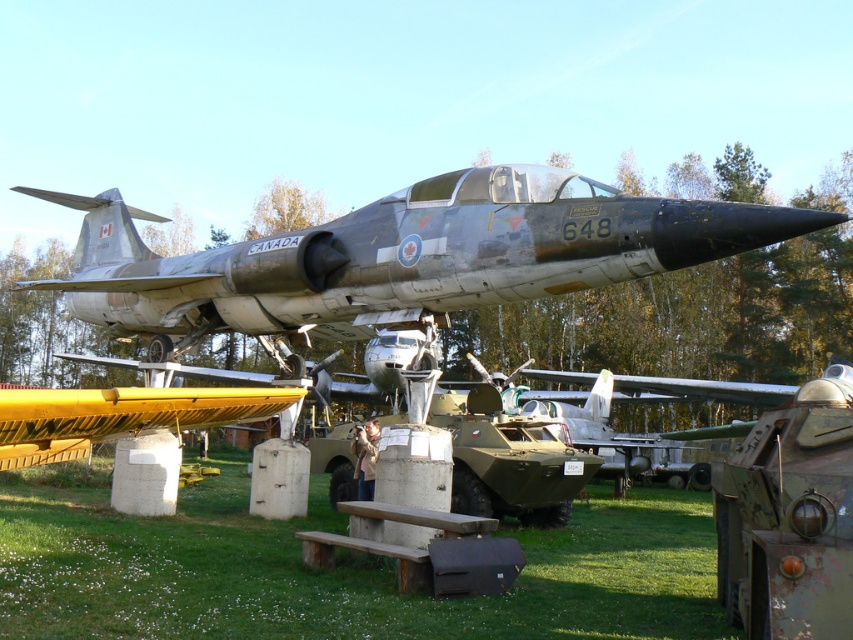
From the picture: You are standing at the entrance of the airfield and want to walk to the Canadian military jet displayed on the stand. There are two points marked as point 1 at coordinates point (538, 566) and point 2 at coordinates point (286, 323). Which point is closer to the entrance?

Point (538, 566) is in front of point (286, 323), so the point closer to the entrance is point (538, 566).

You are a visitor at the airfield and want to sit down. There is a bench nearby, but you see the green grass at center and the camouflage paint fighter jet at center. Which one is closer to you?

The green grass at center is in front of the camouflage paint fighter jet at center, so the green grass at center is closer to you.